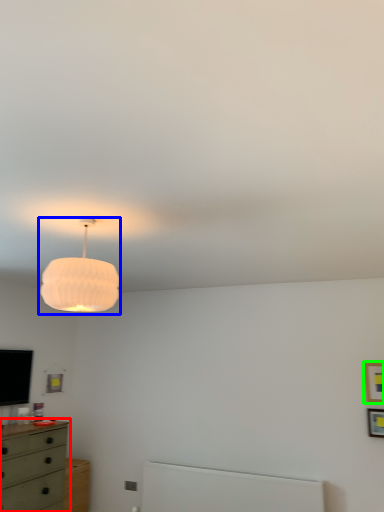
Question: Considering the real-world distances, which object is closest to chest of drawers (highlighted by a red box)? lamp (highlighted by a blue box) or picture frame (highlighted by a green box).

Choices:
 (A) lamp
 (B) picture frame

Answer: (A)